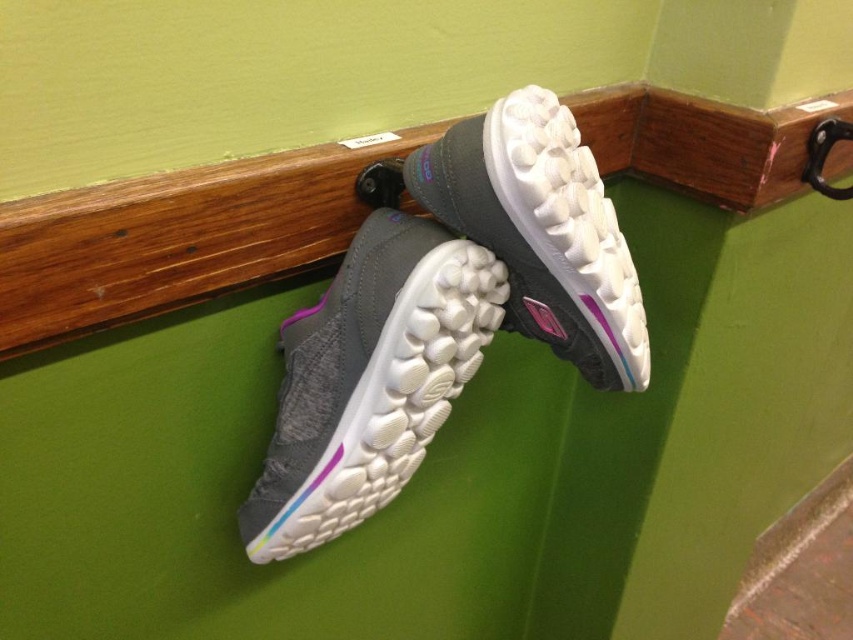
Who is more distant from viewer, (202, 284) or (331, 483)?

The point (331, 483) is behind.

Does point (665, 132) come behind point (471, 358)?

Yes, point (665, 132) is behind point (471, 358).

Is point (277, 166) more distant than point (380, 467)?

No, it is not.

Find the location of a particular element. This screenshot has height=640, width=853. wooden ledge at upper center is located at coordinates (173, 237).

Does point (155, 188) come farther from viewer compared to point (589, 168)?

That is False.

Is wooden ledge at upper center below gray rubber shoe at center?

No, wooden ledge at upper center is not below gray rubber shoe at center.

What do you see at coordinates (173, 237) in the screenshot?
I see `wooden ledge at upper center` at bounding box center [173, 237].

Find the location of a particular element. wooden ledge at upper center is located at coordinates (173, 237).

Can you confirm if gray fabric shoe at center is thinner than gray rubber shoe at center?

In fact, gray fabric shoe at center might be wider than gray rubber shoe at center.

Is gray fabric shoe at center above gray rubber shoe at center?

No, gray fabric shoe at center is not above gray rubber shoe at center.

Who is more distant from viewer, (x=354, y=364) or (x=589, y=168)?

The point (x=589, y=168) is more distant.

I want to click on gray fabric shoe at center, so click(x=369, y=380).